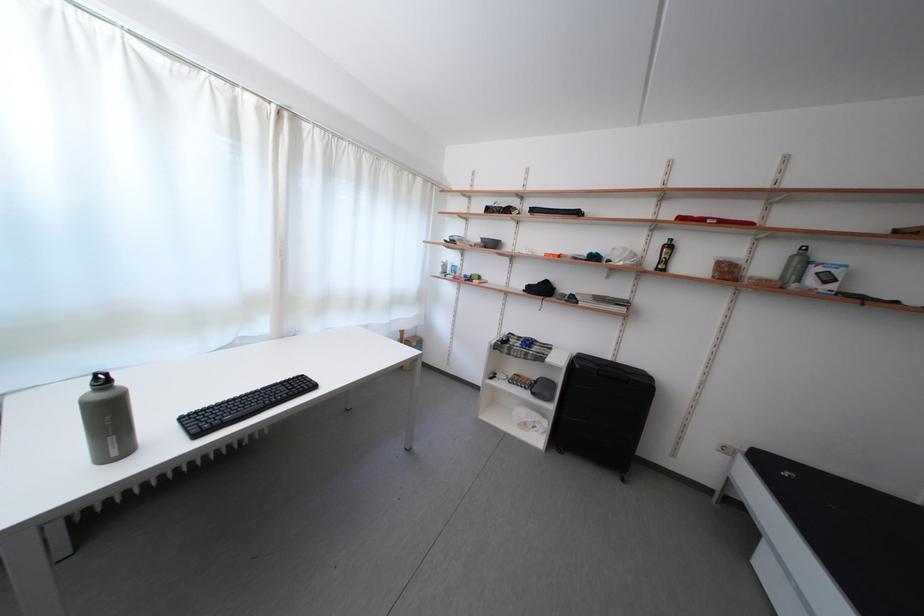
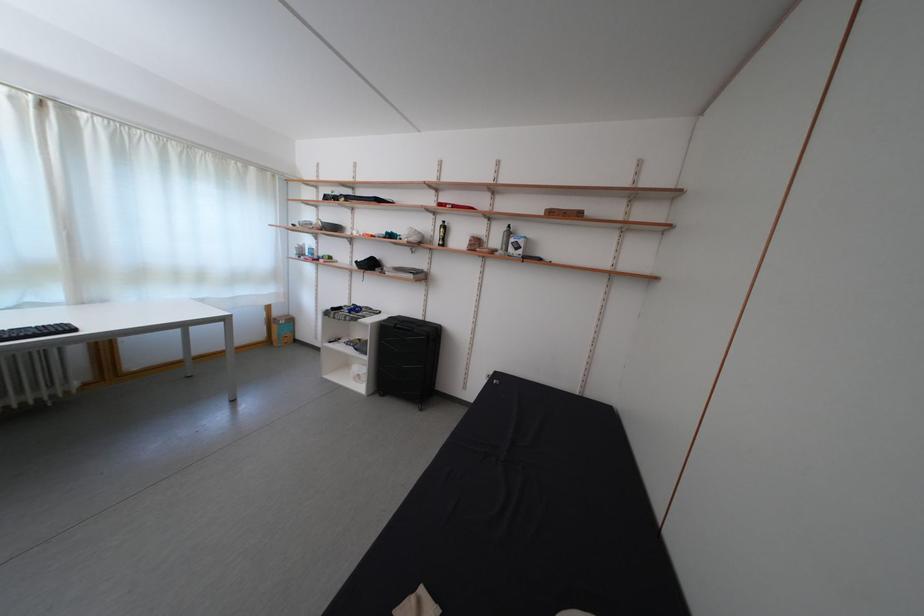
Where in the second image is the point corresponding to (x=774, y=272) from the first image?

(505, 246)